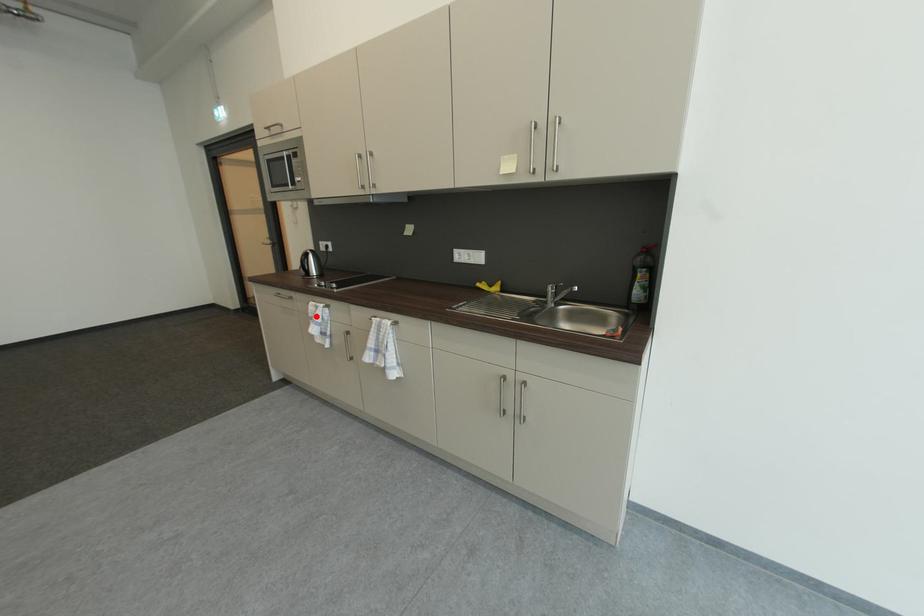
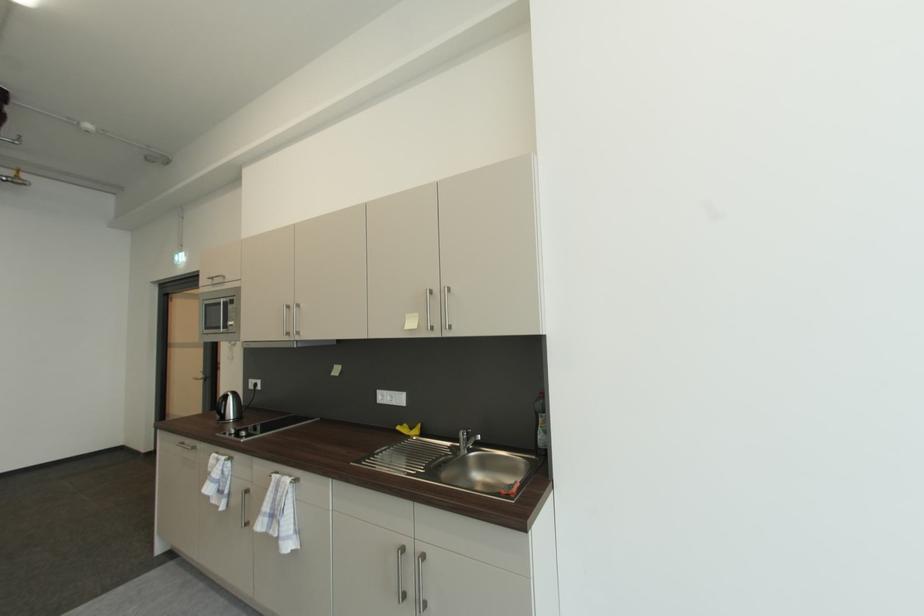
Question: I am providing you with two images of the same scene from different viewpoints. A red point is marked on the first image. At the location where the point appears in image 1, is it still visible in image 2?

Choices:
 (A) Yes
 (B) No

Answer: (A)